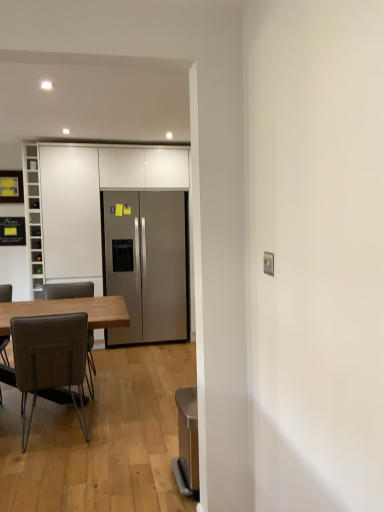
Question: Relative to white glossy cabinets at center, the first cabinetry viewed from the right, is wooden table at left in front or behind?

Choices:
 (A) front
 (B) behind

Answer: (A)

Question: Considering the positions of point (31, 309) and point (72, 254), is point (31, 309) closer or farther from the camera than point (72, 254)?

Choices:
 (A) closer
 (B) farther

Answer: (A)

Question: Which object is the closest to the wooden table at left?

Choices:
 (A) white glossy cabinets at center, the first cabinetry viewed from the right
 (B) metallic gray trash can at lower right
 (C) brown leather chair at left, marked as the second chair in a front-to-back arrangement
 (D) white glass wine rack at left, acting as the 1th cabinetry starting from the left
 (E) satin silver refrigerator at center

Answer: (B)

Question: Which object is positioned closest to the white glass wine rack at left, acting as the 1th cabinetry starting from the left?

Choices:
 (A) wooden table at left
 (B) brown leather chair at left, the 2th chair positioned from the back
 (C) satin silver refrigerator at center
 (D) metallic gray trash can at lower right
 (E) white glossy cabinets at center, which is the second cabinetry in left-to-right order

Answer: (E)